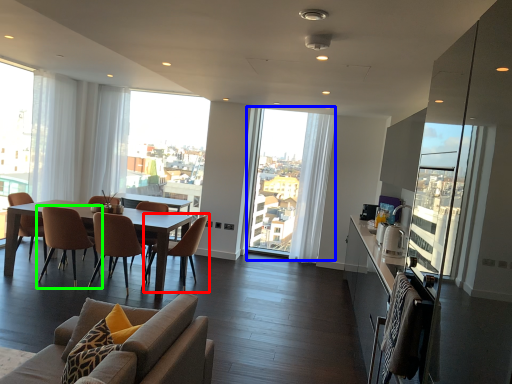
Question: Based on their relative distances, which object is farther from chair (highlighted by a red box)? Choose from window (highlighted by a blue box) and chair (highlighted by a green box).

Choices:
 (A) window
 (B) chair

Answer: (A)